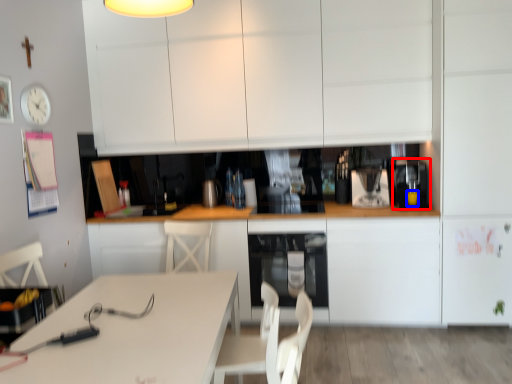
Question: Among these objects, which one is farthest to the camera, coffee machine (highlighted by a red box) or beverage (highlighted by a blue box)?

Choices:
 (A) coffee machine
 (B) beverage

Answer: (B)